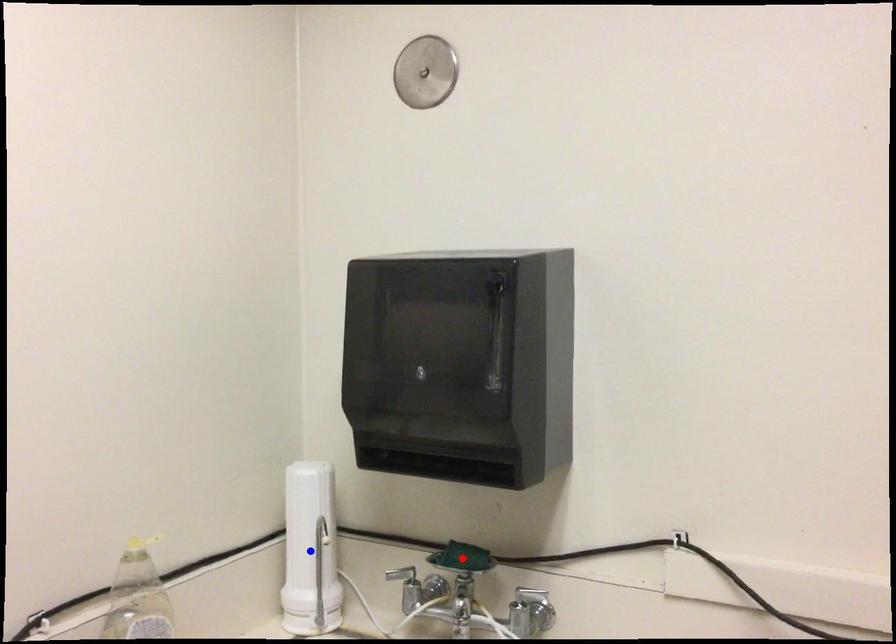
Question: In the image, two points are highlighted. Which point is nearer to the camera? Reply with the corresponding letter.

Choices:
 (A) blue point
 (B) red point

Answer: (B)